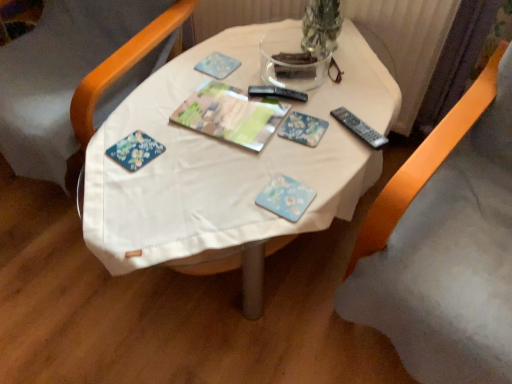
You are a GUI agent. You are given a task and a screenshot of the screen. Output one action in this format:
    pyautogui.click(x=<x>, y=<y>)
    Task: Click on the blank space to the left of floral-patterned paper at center-left
    This screenshot has width=512, height=384.
    Given the screenshot: What is the action you would take?
    pyautogui.click(x=105, y=147)